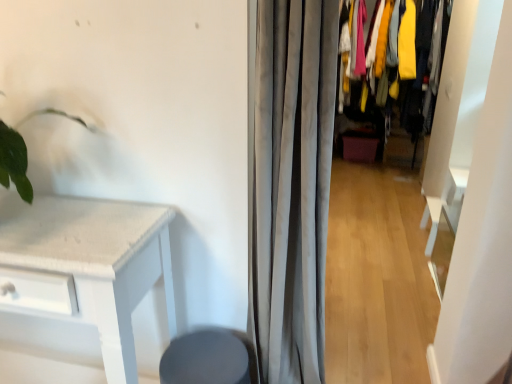
The height and width of the screenshot is (384, 512). Identify the location of free point above matte gray swivel chair at lower center (from a real-world perspective). (211, 361).